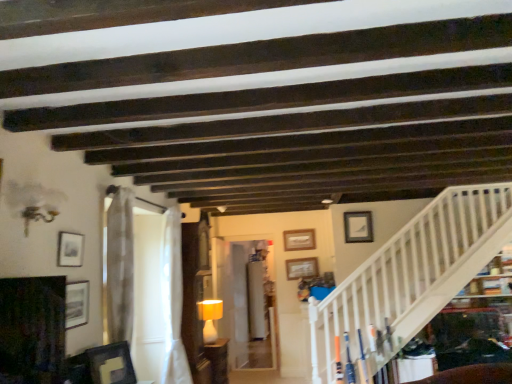
The height and width of the screenshot is (384, 512). Describe the element at coordinates (70, 249) in the screenshot. I see `matte black picture frame at upper left, which is the 5th picture frame in back-to-front order` at that location.

This screenshot has width=512, height=384. I want to click on matte black picture frame at upper left, the 1th picture frame viewed from the left, so click(x=70, y=249).

Measure the distance between matte yellow lampshade at center and camera.

matte yellow lampshade at center and camera are 4.54 meters apart from each other.

The height and width of the screenshot is (384, 512). What do you see at coordinates (111, 364) in the screenshot?
I see `matte black picture frame at lower left, which is the third picture frame from left to right` at bounding box center [111, 364].

This screenshot has width=512, height=384. Describe the element at coordinates (298, 240) in the screenshot. I see `wooden picture frame at upper center, which is counted as the fourth picture frame, starting from the left` at that location.

What do you see at coordinates (77, 304) in the screenshot? I see `matte black picture frame at left, the fifth picture frame positioned from the right` at bounding box center [77, 304].

Find the location of a particular element. Image resolution: width=512 pixels, height=384 pixels. matte black picture frame at left, which is the second picture frame in left-to-right order is located at coordinates (77, 304).

You are a GUI agent. You are given a task and a screenshot of the screen. Output one action in this format:
    pyautogui.click(x=<x>, y=<y>)
    Task: Click on the matte black picture frame at upper left, which is the 5th picture frame in back-to-front order
    This screenshot has height=384, width=512.
    Given the screenshot: What is the action you would take?
    pyautogui.click(x=70, y=249)

Who is bigger, wooden picture frame at upper center, the sixth picture frame positioned from the front, or matte white picture frame at upper right, which is counted as the 4th picture frame, starting from the front?

wooden picture frame at upper center, the sixth picture frame positioned from the front, is bigger.

From a real-world perspective, which object rests below the other?

From a 3D spatial view, wooden picture frame at upper center, positioned as the 3th picture frame in right-to-left order, is below.

Can you tell me how much wooden picture frame at upper center, which is counted as the fourth picture frame, starting from the left, and matte white picture frame at upper right, the third picture frame viewed from the back, differ in facing direction?

They differ by 0.409 degrees in their facing directions.

Does wooden picture frame at upper center, which ranks as the 1th picture frame in back-to-front order, turn towards matte white picture frame at upper right, which appears as the 1th picture frame when viewed from the right?

No, wooden picture frame at upper center, which ranks as the 1th picture frame in back-to-front order, is not aimed at matte white picture frame at upper right, which appears as the 1th picture frame when viewed from the right.

Is matte yellow lampshade at center facing away from wooden picture frame at center, which ranks as the 5th picture frame in front-to-back order?

matte yellow lampshade at center does not have its back to wooden picture frame at center, which ranks as the 5th picture frame in front-to-back order.

From the image's perspective, starting from the matte yellow lampshade at center, which picture frame is the 2nd one above? Please provide its 2D coordinates.

[(302, 268)]

Can you confirm if matte yellow lampshade at center is shorter than wooden picture frame at center, which is counted as the second picture frame, starting from the right?

In fact, matte yellow lampshade at center may be taller than wooden picture frame at center, which is counted as the second picture frame, starting from the right.

Measure the distance from matte yellow lampshade at center to wooden picture frame at center, which is counted as the second picture frame, starting from the right.

matte yellow lampshade at center is 1.33 meters from wooden picture frame at center, which is counted as the second picture frame, starting from the right.

Based on the photo, considering the sizes of objects matte yellow lampshade at center and sheer white curtain at center, which is the first curtain in front-to-back order, in the image provided, who is thinner, matte yellow lampshade at center or sheer white curtain at center, which is the first curtain in front-to-back order,?

matte yellow lampshade at center is thinner.

Find the location of a particular element. Image resolution: width=512 pixels, height=384 pixels. lamp behind the sheer white curtain at center, which is the first curtain in front-to-back order is located at coordinates (210, 318).

In terms of height, does matte yellow lampshade at center look taller or shorter compared to sheer white curtain at center, the 2th curtain from the back?

In the image, matte yellow lampshade at center appears to be shorter than sheer white curtain at center, the 2th curtain from the back.

Based on the photo, how many degrees apart are the facing directions of matte yellow lampshade at center and sheer white curtain at center, which is the first curtain in front-to-back order?

1.63 degrees separate the facing orientations of matte yellow lampshade at center and sheer white curtain at center, which is the first curtain in front-to-back order.

Based on the photo, from a real-world perspective, who is located higher, matte yellow lampshade at center or matte black picture frame at lower left, the fourth picture frame viewed from the back?

matte black picture frame at lower left, the fourth picture frame viewed from the back.

Considering the relative sizes of matte yellow lampshade at center and matte black picture frame at lower left, the third picture frame viewed from the front, in the image provided, is matte yellow lampshade at center bigger than matte black picture frame at lower left, the third picture frame viewed from the front,?

Yes, matte yellow lampshade at center is bigger than matte black picture frame at lower left, the third picture frame viewed from the front.

Does matte yellow lampshade at center have a greater height compared to matte black picture frame at lower left, the fourth picture frame viewed from the back?

Indeed, matte yellow lampshade at center has a greater height compared to matte black picture frame at lower left, the fourth picture frame viewed from the back.

From the picture: Is matte yellow lampshade at center oriented towards matte black picture frame at lower left, which ranks as the 4th picture frame in right-to-left order?

No, matte yellow lampshade at center does not turn towards matte black picture frame at lower left, which ranks as the 4th picture frame in right-to-left order.

Could you tell me if white sheer curtain at center, the first curtain in the back-to-front sequence, is facing sheer white curtain at center, the 2th curtain from the back?

No, white sheer curtain at center, the first curtain in the back-to-front sequence, is not oriented towards sheer white curtain at center, the 2th curtain from the back.

Between white sheer curtain at center, the second curtain in the front-to-back sequence, and sheer white curtain at center, which is the first curtain in front-to-back order, which one is positioned behind?

Positioned behind is white sheer curtain at center, the second curtain in the front-to-back sequence.

Would you say white sheer curtain at center, the second curtain in the front-to-back sequence, contains sheer white curtain at center, which is the first curtain in front-to-back order?

No, sheer white curtain at center, which is the first curtain in front-to-back order, is not surrounded by white sheer curtain at center, the second curtain in the front-to-back sequence.

Which is closer, (182, 287) or (113, 197)?

Clearly, point (182, 287) is more distant from the camera than point (113, 197).

From the matte yellow lampshade at center, count the 1st picture frame to the left and point to it. Please provide its 2D coordinates.

[(111, 364)]

From the image's perspective, which is below, matte yellow lampshade at center or matte black picture frame at lower left, the third picture frame viewed from the front?

matte yellow lampshade at center.

Is matte yellow lampshade at center bigger than matte black picture frame at lower left, the fourth picture frame viewed from the back?

Yes.

From a real-world perspective, is matte yellow lampshade at center below matte black picture frame at lower left, which is the third picture frame from left to right?

Correct, in the physical world, matte yellow lampshade at center is lower than matte black picture frame at lower left, which is the third picture frame from left to right.

Where is `lamp lying below the white wooden stairwell at lower right (from the image's perspective)`? The width and height of the screenshot is (512, 384). lamp lying below the white wooden stairwell at lower right (from the image's perspective) is located at coordinates (210, 318).

Can you see matte yellow lampshade at center touching white wooden stairwell at lower right?

No, matte yellow lampshade at center is not beside white wooden stairwell at lower right.

Between point (204, 316) and point (435, 239), which one is positioned in front?

The point (435, 239) is in front.

At what (x,y) coordinates should I click in order to perform the action: click on picture frame above the wooden picture frame at upper center, which ranks as the 1th picture frame in back-to-front order (from a real-world perspective). Please return your answer as a coordinate pair (x, y). The width and height of the screenshot is (512, 384). Looking at the image, I should click on (358, 227).

Find the location of a particular element. The height and width of the screenshot is (384, 512). lamp below the wooden picture frame at center, which is counted as the second picture frame, starting from the right (from the image's perspective) is located at coordinates (210, 318).

When comparing their distances from white sheer curtain at center, the first curtain in the back-to-front sequence, does wooden picture frame at upper center, the sixth picture frame positioned from the front, or matte yellow lampshade at center seem further?

The object further to white sheer curtain at center, the first curtain in the back-to-front sequence, is wooden picture frame at upper center, the sixth picture frame positioned from the front.

When comparing their distances from matte black picture frame at lower left, which is the third picture frame from left to right, does white wooden stairwell at lower right or wooden picture frame at upper center, which ranks as the 1th picture frame in back-to-front order, seem further?

wooden picture frame at upper center, which ranks as the 1th picture frame in back-to-front order, is positioned further to the anchor matte black picture frame at lower left, which is the third picture frame from left to right.

Estimate the real-world distances between objects in this image. Which object is closer to wooden picture frame at center, arranged as the fifth picture frame when viewed from the left, wooden picture frame at upper center, positioned as the 3th picture frame in right-to-left order, or matte black picture frame at upper left, the 1th picture frame viewed from the left?

wooden picture frame at upper center, positioned as the 3th picture frame in right-to-left order, lies closer to wooden picture frame at center, arranged as the fifth picture frame when viewed from the left, than the other object.

Looking at the image, which one is located further to matte black picture frame at left, the 6th picture frame when ordered from back to front, wooden picture frame at upper center, positioned as the 3th picture frame in right-to-left order, or white wooden stairwell at lower right?

Among the two, wooden picture frame at upper center, positioned as the 3th picture frame in right-to-left order, is located further to matte black picture frame at left, the 6th picture frame when ordered from back to front.

Based on their spatial positions, is matte yellow lampshade at center or matte black picture frame at lower left, the third picture frame viewed from the front, closer to white wooden stairwell at lower right?

The object closer to white wooden stairwell at lower right is matte yellow lampshade at center.

Based on their spatial positions, is white wooden stairwell at lower right or wooden picture frame at center, which is counted as the second picture frame, starting from the right, closer to matte white picture frame at upper right, the third picture frame viewed from the back?

Among the two, wooden picture frame at center, which is counted as the second picture frame, starting from the right, is located nearer to matte white picture frame at upper right, the third picture frame viewed from the back.

When comparing their distances from matte white picture frame at upper right, the third picture frame viewed from the back, does matte black picture frame at upper left, the second picture frame from the front, or matte yellow lampshade at center seem closer?

matte yellow lampshade at center is positioned closer to the anchor matte white picture frame at upper right, the third picture frame viewed from the back.

From the image, which object appears to be nearer to matte yellow lampshade at center, matte black picture frame at left, which is the 1th picture frame in front-to-back order, or sheer white curtain at center, the 2th curtain from the back?

Based on the image, sheer white curtain at center, the 2th curtain from the back, appears to be nearer to matte yellow lampshade at center.

Image resolution: width=512 pixels, height=384 pixels. What are the coordinates of `furniture between sheer white curtain at center, which is the first curtain in front-to-back order, and wooden picture frame at upper center, which ranks as the 1th picture frame in back-to-front order, along the z-axis` in the screenshot? It's located at (218, 360).

Identify the location of curtain located between sheer white curtain at center, which is the first curtain in front-to-back order, and white wooden stairwell at lower right in the left-right direction. (173, 301).

The width and height of the screenshot is (512, 384). I want to click on lamp between matte yellow lampshade at center and wooden picture frame at center, which is counted as the second picture frame, starting from the right, in the front-back direction, so click(210, 318).

This screenshot has width=512, height=384. I want to click on curtain between sheer white curtain at center, the 2th curtain from the back, and wooden picture frame at upper center, which is counted as the fourth picture frame, starting from the left, in the front-back direction, so click(x=173, y=301).